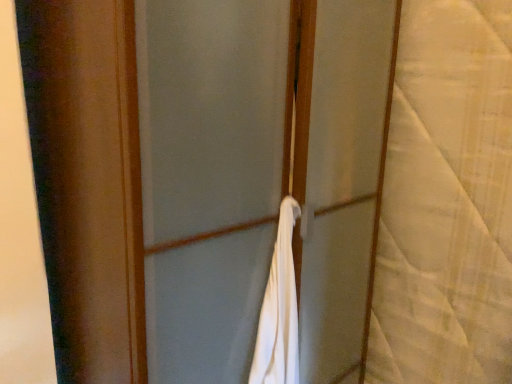
Question: Is white fabric at center further to camera compared to white textured fabric at right?

Choices:
 (A) yes
 (B) no

Answer: (B)

Question: Considering the relative sizes of white fabric at center and white textured fabric at right in the image provided, is white fabric at center taller than white textured fabric at right?

Choices:
 (A) yes
 (B) no

Answer: (A)

Question: Is white textured fabric at right located within white fabric at center?

Choices:
 (A) no
 (B) yes

Answer: (A)

Question: Considering the relative sizes of white fabric at center and white textured fabric at right in the image provided, is white fabric at center smaller than white textured fabric at right?

Choices:
 (A) yes
 (B) no

Answer: (B)

Question: Is white fabric at center at the right side of white textured fabric at right?

Choices:
 (A) yes
 (B) no

Answer: (B)

Question: Is white fabric at center placed right next to white textured fabric at right?

Choices:
 (A) yes
 (B) no

Answer: (B)

Question: From a real-world perspective, is white textured fabric at right on white fabric at center?

Choices:
 (A) no
 (B) yes

Answer: (B)

Question: Is white textured fabric at right taller than white fabric at center?

Choices:
 (A) yes
 (B) no

Answer: (B)

Question: From the image's perspective, would you say white textured fabric at right is shown under white fabric at center?

Choices:
 (A) no
 (B) yes

Answer: (A)

Question: Does white textured fabric at right appear on the left side of white fabric at center?

Choices:
 (A) yes
 (B) no

Answer: (B)

Question: From a real-world perspective, does white textured fabric at right sit lower than white fabric at center?

Choices:
 (A) yes
 (B) no

Answer: (B)

Question: Can you confirm if white textured fabric at right is thinner than white fabric at center?

Choices:
 (A) no
 (B) yes

Answer: (B)

Question: Considering the positions of white fabric at center and white textured fabric at right in the image, is white fabric at center taller or shorter than white textured fabric at right?

Choices:
 (A) short
 (B) tall

Answer: (B)